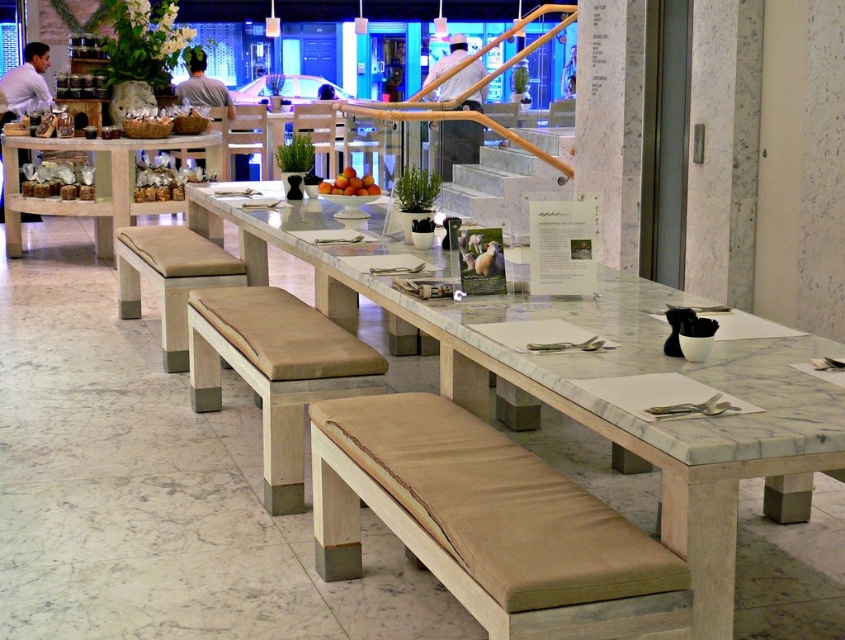
Question: Which of these objects is positioned closest to the brown fabric bench at center?

Choices:
 (A) beige fabric bench at lower left
 (B) tan leather bench at center

Answer: (B)

Question: Among these objects, which one is nearest to the camera?

Choices:
 (A) wooden table at left
 (B) matte brown pastries at center
 (C) beige fabric bench at lower left
 (D) brown fabric bench at center

Answer: (D)

Question: Can you confirm if brown fabric bench at center is positioned below tan leather bench at center?

Choices:
 (A) yes
 (B) no

Answer: (A)

Question: Is brown fabric bench at center further to the viewer compared to orange matte fruit at center?

Choices:
 (A) yes
 (B) no

Answer: (B)

Question: Which point is closer to the camera?

Choices:
 (A) tan leather bench at center
 (B) white marble table at center
 (C) wooden table at left

Answer: (B)

Question: Is brown fabric bench at center bigger than wooden table at left?

Choices:
 (A) no
 (B) yes

Answer: (A)